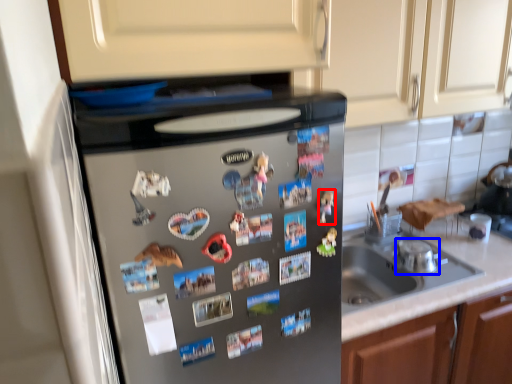
Question: Which object is further to the camera taking this photo, toy (highlighted by a red box) or appliance (highlighted by a blue box)?

Choices:
 (A) toy
 (B) appliance

Answer: (B)